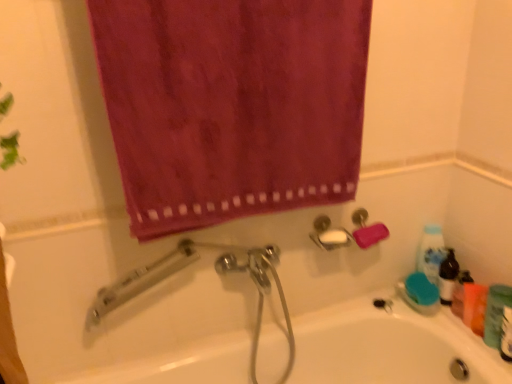
What do you see at coordinates (431, 252) in the screenshot? This screenshot has width=512, height=384. I see `blue glossy bottle at right` at bounding box center [431, 252].

The height and width of the screenshot is (384, 512). What do you see at coordinates (474, 306) in the screenshot?
I see `orange matte bottle at right, the first mouthwash from the back` at bounding box center [474, 306].

The image size is (512, 384). I want to click on blue glossy bottle at right, so click(x=431, y=252).

From the picture: Measure the distance between velvet-like magenta towel at upper center and orange matte bottle at right, the first mouthwash from the back.

They are 95.28 centimeters apart.

How many degrees apart are the facing directions of velvet-like magenta towel at upper center and orange matte bottle at right, the second mouthwash in the right-to-left sequence?

The angular difference between velvet-like magenta towel at upper center and orange matte bottle at right, the second mouthwash in the right-to-left sequence, is 84.8 degrees.

Considering the relative sizes of velvet-like magenta towel at upper center and orange matte bottle at right, marked as the first mouthwash in a left-to-right arrangement, in the image provided, is velvet-like magenta towel at upper center thinner than orange matte bottle at right, marked as the first mouthwash in a left-to-right arrangement,?

No, velvet-like magenta towel at upper center is not thinner than orange matte bottle at right, marked as the first mouthwash in a left-to-right arrangement.

Consider the image. From a real-world perspective, which object rests below the other?

orange matte bottle at right, the second mouthwash in the right-to-left sequence.

From the image's perspective, which is below, green matte bottle at lower right or white glossy bathtub at center?

white glossy bathtub at center is shown below in the image.

Where is `toiletry that appears above the white glossy bathtub at center (from the image's perspective)`? The width and height of the screenshot is (512, 384). toiletry that appears above the white glossy bathtub at center (from the image's perspective) is located at coordinates (496, 313).

From a real-world perspective, is green matte bottle at lower right physically above white glossy bathtub at center?

Yes, from a real-world perspective, green matte bottle at lower right is over white glossy bathtub at center

Is point (494, 322) more distant than point (462, 329)?

No, (494, 322) is in front of (462, 329).

Who is shorter, orange matte bottle at right, which is the 2th mouthwash in front-to-back order, or green plastic mouthwash at lower right, the second mouthwash from the back?

orange matte bottle at right, which is the 2th mouthwash in front-to-back order, is shorter.

Is orange matte bottle at right, marked as the first mouthwash in a left-to-right arrangement, looking in the opposite direction of green plastic mouthwash at lower right, which is counted as the first mouthwash, starting from the right?

No, orange matte bottle at right, marked as the first mouthwash in a left-to-right arrangement, is not facing the opposite direction of green plastic mouthwash at lower right, which is counted as the first mouthwash, starting from the right.

Between orange matte bottle at right, the second mouthwash in the right-to-left sequence, and green plastic mouthwash at lower right, the 1th mouthwash from the front, which one has smaller size?

With smaller size is orange matte bottle at right, the second mouthwash in the right-to-left sequence.

Between orange matte bottle at right, which is the 2th mouthwash in front-to-back order, and green plastic mouthwash at lower right, the second mouthwash from the back, which one appears on the right side from the viewer's perspective?

green plastic mouthwash at lower right, the second mouthwash from the back.

Can you confirm if white glossy bathtub at center is smaller than green plastic mouthwash at lower right, which appears as the second mouthwash when viewed from the left?

Actually, white glossy bathtub at center might be larger than green plastic mouthwash at lower right, which appears as the second mouthwash when viewed from the left.

Considering the sizes of objects white glossy bathtub at center and green plastic mouthwash at lower right, which appears as the second mouthwash when viewed from the left, in the image provided, who is shorter, white glossy bathtub at center or green plastic mouthwash at lower right, which appears as the second mouthwash when viewed from the left,?

green plastic mouthwash at lower right, which appears as the second mouthwash when viewed from the left.

Considering the positions of objects white glossy bathtub at center and green plastic mouthwash at lower right, which is counted as the first mouthwash, starting from the right, in the image provided, who is behind, white glossy bathtub at center or green plastic mouthwash at lower right, which is counted as the first mouthwash, starting from the right,?

green plastic mouthwash at lower right, which is counted as the first mouthwash, starting from the right, is further from the camera.

From the picture: From the image's perspective, which one is positioned higher, white glossy bathtub at center or green plastic mouthwash at lower right, the second mouthwash from the back?

green plastic mouthwash at lower right, the second mouthwash from the back.

Is green plastic mouthwash at lower right, the 1th mouthwash from the front, to the right of orange matte bottle at right, the second mouthwash in the right-to-left sequence, from the viewer's perspective?

Indeed, green plastic mouthwash at lower right, the 1th mouthwash from the front, is positioned on the right side of orange matte bottle at right, the second mouthwash in the right-to-left sequence.

From the image's perspective, which is above, green plastic mouthwash at lower right, the second mouthwash from the back, or orange matte bottle at right, the first mouthwash from the back?

orange matte bottle at right, the first mouthwash from the back, from the image's perspective.

From a real-world perspective, who is located higher, green plastic mouthwash at lower right, the second mouthwash from the back, or orange matte bottle at right, marked as the first mouthwash in a left-to-right arrangement?

In real-world perspective, green plastic mouthwash at lower right, the second mouthwash from the back, is above.

From their relative heights in the image, would you say orange matte bottle at right, the first mouthwash from the back, is taller or shorter than velvet-like magenta towel at upper center?

Clearly, orange matte bottle at right, the first mouthwash from the back, is shorter compared to velvet-like magenta towel at upper center.

Is orange matte bottle at right, which is the 2th mouthwash in front-to-back order, turned away from velvet-like magenta towel at upper center?

orange matte bottle at right, which is the 2th mouthwash in front-to-back order, does not have its back to velvet-like magenta towel at upper center.

Would you say orange matte bottle at right, the second mouthwash in the right-to-left sequence, is inside or outside velvet-like magenta towel at upper center?

orange matte bottle at right, the second mouthwash in the right-to-left sequence, cannot be found inside velvet-like magenta towel at upper center.

Between green matte bottle at lower right and orange matte bottle at right, the second mouthwash in the right-to-left sequence, which one has smaller width?

With smaller width is orange matte bottle at right, the second mouthwash in the right-to-left sequence.

Is green matte bottle at lower right further to the viewer compared to orange matte bottle at right, which is the 2th mouthwash in front-to-back order?

No, it is in front of orange matte bottle at right, which is the 2th mouthwash in front-to-back order.

Is green matte bottle at lower right bigger than orange matte bottle at right, the second mouthwash in the right-to-left sequence?

Correct, green matte bottle at lower right is larger in size than orange matte bottle at right, the second mouthwash in the right-to-left sequence.

Where is `curtain that is on the left side of orange matte bottle at right, the second mouthwash in the right-to-left sequence`? curtain that is on the left side of orange matte bottle at right, the second mouthwash in the right-to-left sequence is located at coordinates (231, 105).

Locate an element on the screen. This screenshot has height=384, width=512. toiletry lying above the white glossy bathtub at center (from the image's perspective) is located at coordinates (496, 313).

Considering their positions, is blue glossy bottle at right positioned further to velvet-like magenta towel at upper center than green matte bottle at lower right?

green matte bottle at lower right lies further to velvet-like magenta towel at upper center than the other object.

Considering their positions, is blue glossy bottle at right positioned further to white glossy bathtub at center than orange matte bottle at right, the first mouthwash from the back?

Among the two, blue glossy bottle at right is located further to white glossy bathtub at center.

Considering their positions, is green matte bottle at lower right positioned further to orange matte bottle at right, the second mouthwash in the right-to-left sequence, than velvet-like magenta towel at upper center?

velvet-like magenta towel at upper center lies further to orange matte bottle at right, the second mouthwash in the right-to-left sequence, than the other object.

Based on the photo, considering their positions, is white glossy bathtub at center positioned further to green plastic mouthwash at lower right, the second mouthwash from the back, than orange matte bottle at right, the first mouthwash from the back?

white glossy bathtub at center is further to green plastic mouthwash at lower right, the second mouthwash from the back.

Based on the photo, which object lies nearer to the anchor point green plastic mouthwash at lower right, which appears as the second mouthwash when viewed from the left, orange matte bottle at right, marked as the first mouthwash in a left-to-right arrangement, or blue glossy bottle at right?

Based on the image, orange matte bottle at right, marked as the first mouthwash in a left-to-right arrangement, appears to be nearer to green plastic mouthwash at lower right, which appears as the second mouthwash when viewed from the left.

Looking at the image, which one is located closer to orange matte bottle at right, marked as the first mouthwash in a left-to-right arrangement, velvet-like magenta towel at upper center or blue glossy bottle at right?

blue glossy bottle at right is closer to orange matte bottle at right, marked as the first mouthwash in a left-to-right arrangement.

Looking at the image, which one is located closer to velvet-like magenta towel at upper center, green matte bottle at lower right or blue glossy bottle at right?

blue glossy bottle at right.

From the image, which object appears to be nearer to green matte bottle at lower right, orange matte bottle at right, which is the 2th mouthwash in front-to-back order, or blue glossy bottle at right?

orange matte bottle at right, which is the 2th mouthwash in front-to-back order, is closer to green matte bottle at lower right.

Identify the location of cleaning product between white glossy bathtub at center and green plastic mouthwash at lower right, the second mouthwash from the back, from left to right. (431, 252).

The image size is (512, 384). Identify the location of toiletry between green plastic mouthwash at lower right, the 1th mouthwash from the front, and orange matte bottle at right, which is the 2th mouthwash in front-to-back order, along the z-axis. (496, 313).

What are the coordinates of `mouthwash located between green plastic mouthwash at lower right, which is counted as the first mouthwash, starting from the right, and blue glossy bottle at right in the depth direction` in the screenshot? It's located at (474, 306).

Identify the location of mouthwash between velvet-like magenta towel at upper center and green plastic mouthwash at lower right, which appears as the second mouthwash when viewed from the left, from left to right. (474, 306).